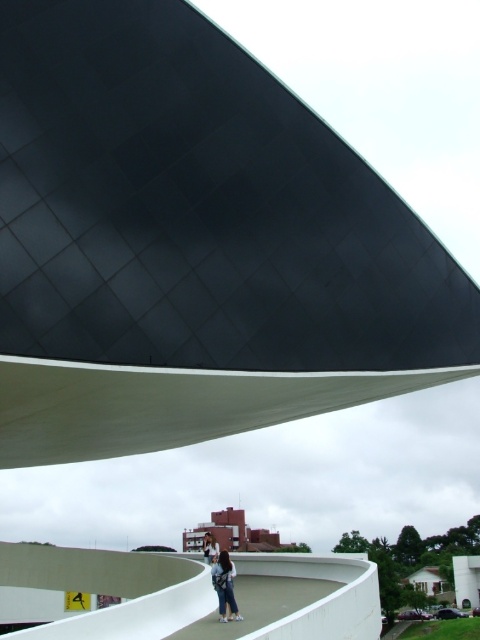
Which is below, black matte/texture roof at upper center or brick building at lower center?

brick building at lower center

Between point (276, 305) and point (239, 540), which one is positioned behind?

The point (239, 540) is behind.

Find the location of `black matte/texture roof at upper center`. black matte/texture roof at upper center is located at coordinates (192, 244).

Is white smooth ramp at lower center thinner than brick building at lower center?

Indeed, white smooth ramp at lower center has a lesser width compared to brick building at lower center.

Locate an element on the screen. This screenshot has width=480, height=640. white smooth ramp at lower center is located at coordinates (108, 589).

In the scene shown: Which is below, black matte/texture roof at upper center or denim pants at lower center?

Positioned lower is denim pants at lower center.

Is black matte/texture roof at upper center shorter than denim pants at lower center?

In fact, black matte/texture roof at upper center may be taller than denim pants at lower center.

Is point (196, 188) behind point (235, 572)?

Yes, point (196, 188) is farther from viewer.

Identify the location of black matte/texture roof at upper center. The width and height of the screenshot is (480, 640). (192, 244).